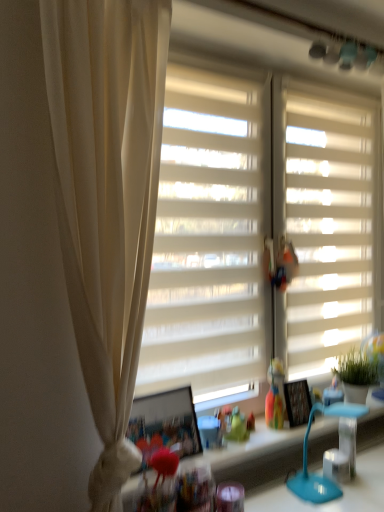
Where is `empty space that is ontop of white matte window screen at center (from a real-world perspective)`? The image size is (384, 512). empty space that is ontop of white matte window screen at center (from a real-world perspective) is located at coordinates pyautogui.click(x=214, y=62).